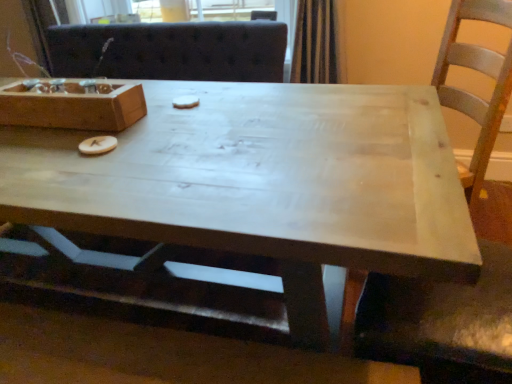
At what (x,y) coordinates should I click in order to perform the action: click on unoccupied area in front of wooden box at upper left. Please return your answer as a coordinate pair (x, y). Looking at the image, I should click on (54, 153).